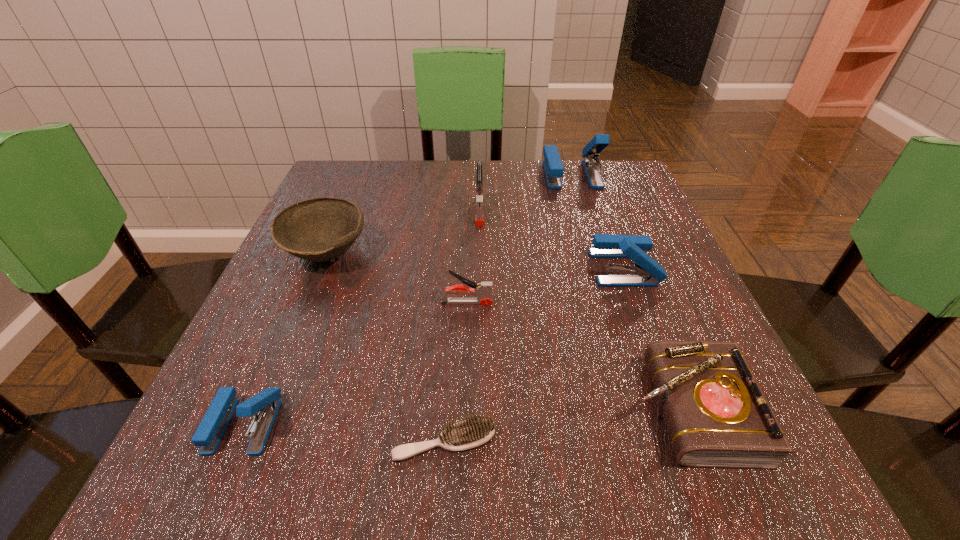
Image resolution: width=960 pixels, height=540 pixels. Identify the location of free space located on the left of the scrubbing brush. (258, 441).

Where is `stapler positioned at the near edge`? This screenshot has height=540, width=960. stapler positioned at the near edge is located at coordinates (265, 404).

You are a GUI agent. You are given a task and a screenshot of the screen. Output one action in this format:
    pyautogui.click(x=<x>, y=<y>)
    Task: Click on the diary positioned at the near edge
    This screenshot has width=960, height=540.
    Given the screenshot: What is the action you would take?
    pyautogui.click(x=717, y=416)

Find the location of a particular element. The image size is (960, 540). scrubbing brush located in the near edge section of the desktop is located at coordinates (475, 431).

You are a GUI agent. You are given a task and a screenshot of the screen. Output one action in this format:
    pyautogui.click(x=<x>, y=<y>)
    Task: Click on the bowl present at the left edge
    
    Given the screenshot: What is the action you would take?
    pyautogui.click(x=319, y=229)

Where is `stapler present at the left edge`? The image size is (960, 540). stapler present at the left edge is located at coordinates (265, 404).

Locate an element on the screen. The image size is (960, 540). diary that is at the right edge is located at coordinates (717, 416).

Where is `object that is at the near left corner`? This screenshot has height=540, width=960. object that is at the near left corner is located at coordinates (265, 404).

Identify the location of object present at the far right corner. This screenshot has height=540, width=960. pos(553,167).

Identify the location of object that is at the near right corner. This screenshot has width=960, height=540. (717, 416).